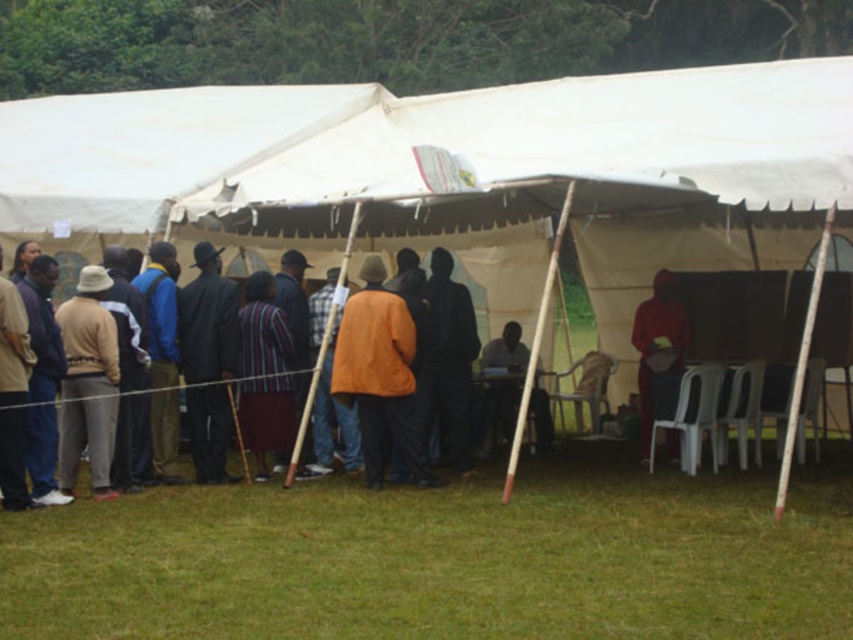
Question: Which of the following is the closest to the observer?

Choices:
 (A) beige fabric jacket at left
 (B) orange suede jacket at center
 (C) blue fabric jacket at center

Answer: (A)

Question: Considering the real-world distances, which object is farthest from the dark brown leather chair at center?

Choices:
 (A) striped fabric shirt at center
 (B) dark blue suit at center

Answer: (B)

Question: Is white fabric canopy at upper center to the right of striped fabric shirt at center from the viewer's perspective?

Choices:
 (A) yes
 (B) no

Answer: (B)

Question: Does dark blue suit at center appear on the left side of beige fabric jacket at left?

Choices:
 (A) yes
 (B) no

Answer: (B)

Question: Among these points, which one is nearest to the camera?

Choices:
 (A) (548, 403)
 (B) (88, 440)

Answer: (B)

Question: From the image, what is the correct spatial relationship of white fabric canopy at upper center in relation to beige fabric jacket at left?

Choices:
 (A) right
 (B) left

Answer: (B)